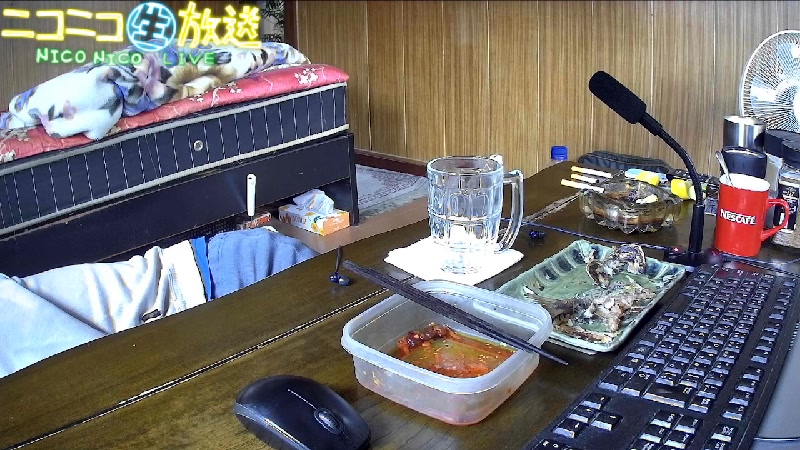
Locate an element on the screen. This screenshot has height=450, width=800. bed is located at coordinates (154, 129).